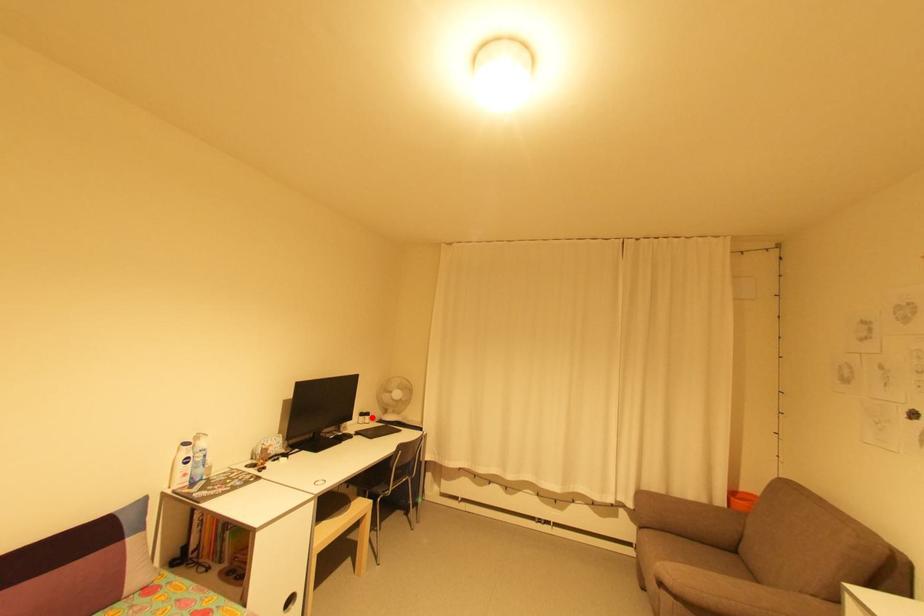
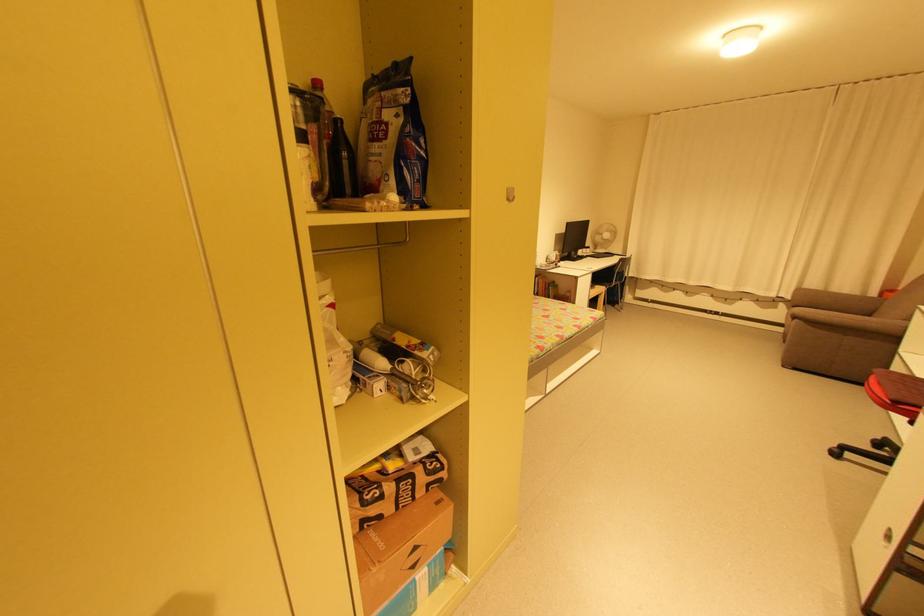
The point at the highlighted location is marked in the first image. Where is the corresponding point in the second image?

(592, 249)